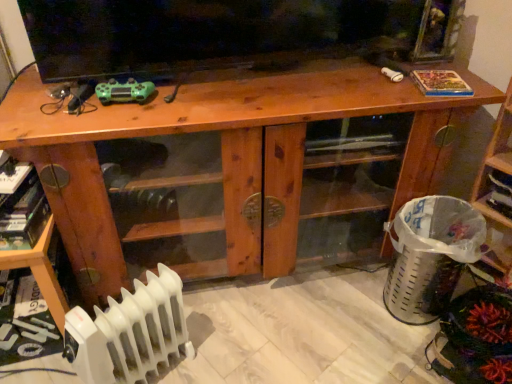
Question: Based on their positions, is white plastic radiator at lower left located to the left or right of wooden cabinet at center?

Choices:
 (A) left
 (B) right

Answer: (A)

Question: In terms of height, does white plastic radiator at lower left look taller or shorter compared to wooden cabinet at center?

Choices:
 (A) tall
 (B) short

Answer: (B)

Question: Which of these objects is positioned closest to the wooden shelf at lower left, the 1th shelf from the left?

Choices:
 (A) white plastic radiator at lower left
 (B) green matte controller at upper left
 (C) wooden cabinet at center
 (D) matte black tv at upper center
 (E) wooden shelf at right, acting as the 2th shelf starting from the left

Answer: (A)

Question: Which is nearer to the matte black tv at upper center?

Choices:
 (A) wooden cabinet at center
 (B) wooden shelf at right, acting as the 2th shelf starting from the left
 (C) wooden shelf at lower left, marked as the 2th shelf in a right-to-left arrangement
 (D) white plastic radiator at lower left
 (E) green matte controller at upper left

Answer: (A)